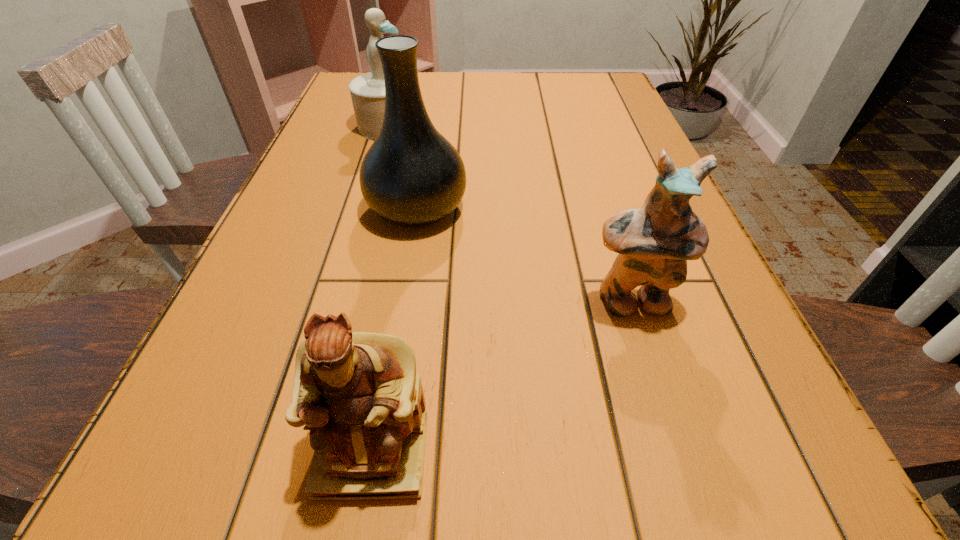
Locate an element on the screen. This screenshot has height=540, width=960. object that is at the right edge is located at coordinates (654, 242).

Locate an element on the screen. free space at the far edge is located at coordinates (468, 86).

Where is `free space at the left edge`? free space at the left edge is located at coordinates (326, 137).

At what (x,y) coordinates should I click in order to perform the action: click on vacant space at the right edge. Please return your answer as a coordinate pair (x, y). This screenshot has height=540, width=960. Looking at the image, I should click on [572, 120].

Image resolution: width=960 pixels, height=540 pixels. What are the coordinates of `vacant space at the far right corner` in the screenshot? It's located at (576, 76).

This screenshot has height=540, width=960. What are the coordinates of `free area in between the nearest figurine and the farthest object` in the screenshot? It's located at (380, 290).

Locate an element on the screen. unoccupied position between the rightmost object and the nearest object is located at coordinates (502, 377).

I want to click on free spot between the farthest figurine and the second farthest figurine, so click(510, 214).

At what (x,y) coordinates should I click in order to perform the action: click on free space between the nearest object and the rightmost object. Please return your answer as a coordinate pair (x, y). This screenshot has width=960, height=540. Looking at the image, I should click on (502, 377).

You are a GUI agent. You are given a task and a screenshot of the screen. Output one action in this format:
    pyautogui.click(x=<x>, y=<y>)
    Task: Click on the empty location between the second nearest figurine and the vase
    
    Given the screenshot: What is the action you would take?
    pyautogui.click(x=524, y=255)